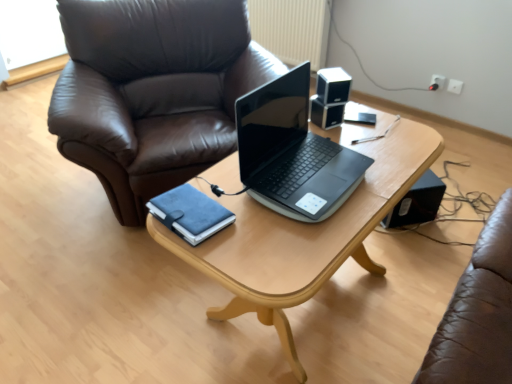
Find the location of a particular element. The height and width of the screenshot is (384, 512). free location to the right of black plastic speaker at upper center, arranged as the 2th speaker when viewed from the top is located at coordinates (373, 126).